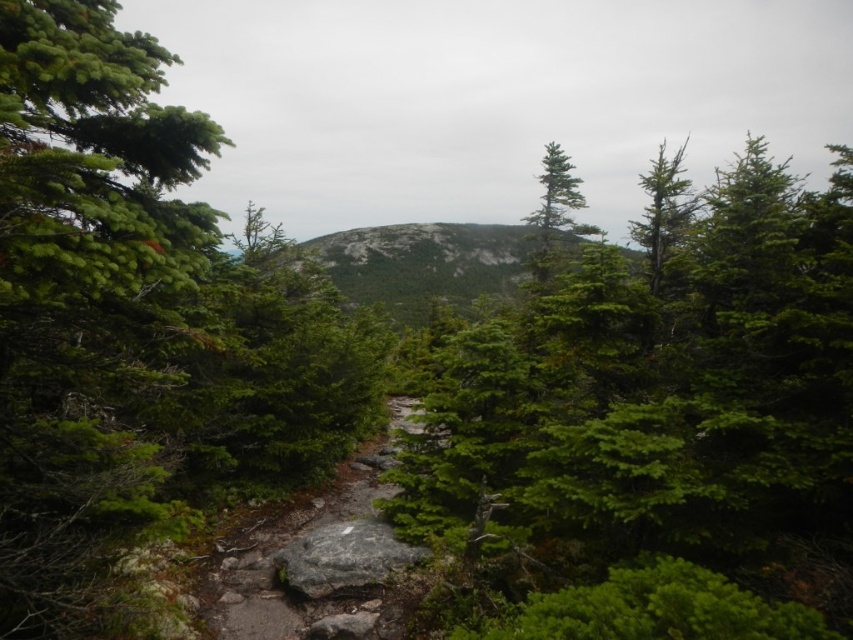
Which is more to the left, green matte tree at center or dull gray stone path at center?

dull gray stone path at center

Is green matte tree at center further to camera compared to dull gray stone path at center?

No, green matte tree at center is closer to the viewer.

Is point (608, 516) positioned in front of point (257, 534)?

Yes, point (608, 516) is closer to viewer.

At what (x,y) coordinates should I click in order to perform the action: click on green matte tree at center. Please return your answer as a coordinate pair (x, y). The image size is (853, 640). Looking at the image, I should click on (657, 428).

Can you confirm if dull gray stone path at center is shorter than gray rough rock at center?

No, dull gray stone path at center is not shorter than gray rough rock at center.

Which of these two, dull gray stone path at center or gray rough rock at center, stands shorter?

Standing shorter between the two is gray rough rock at center.

Describe the element at coordinates (312, 566) in the screenshot. This screenshot has width=853, height=640. I see `dull gray stone path at center` at that location.

Find the location of a particular element. This screenshot has width=853, height=640. dull gray stone path at center is located at coordinates (312, 566).

Does point (42, 42) come in front of point (421, 289)?

Yes.

This screenshot has width=853, height=640. What are the coordinates of `green needle-like at left` in the screenshot? It's located at (126, 317).

Which is behind, point (18, 134) or point (403, 253)?

The point (403, 253) is behind.

What are the coordinates of `green needle-like at left` in the screenshot? It's located at (126, 317).